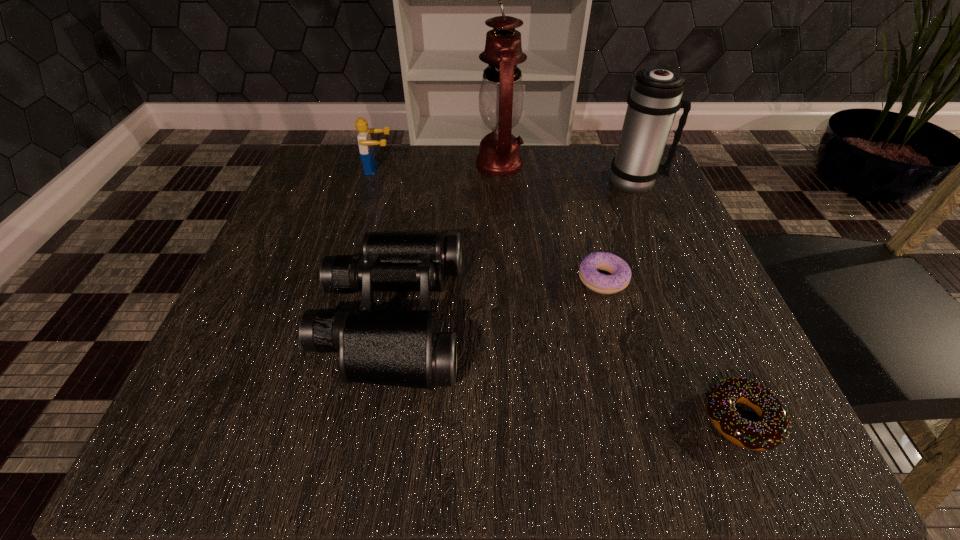
Identify which object is the third nearest to the Lego. Please provide its 2D coordinates. Your answer should be formatted as a tuple, i.e. [(x, y)], where the tuple contains the x and y coordinates of a point satisfying the conditions above.

[(619, 279)]

Identify which object is the second closest to the third object from left to right. Please provide its 2D coordinates. Your answer should be formatted as a tuple, i.e. [(x, y)], where the tuple contains the x and y coordinates of a point satisfying the conditions above.

[(366, 149)]

I want to click on vacant region that satisfies the following two spatial constraints: 1. on the face of the nearer doughnut; 2. on the left side of the Lego, so click(x=306, y=418).

You are a GUI agent. You are given a task and a screenshot of the screen. Output one action in this format:
    pyautogui.click(x=<x>, y=<y>)
    Task: Click on the free region that satisfies the following two spatial constraints: 1. on the side with the handle of the thermos bottle; 2. on the right side of the right doughnut
    
    Given the screenshot: What is the action you would take?
    738,418

This screenshot has width=960, height=540. I want to click on vacant space that satisfies the following two spatial constraints: 1. on the front-facing side of the binoculars; 2. on the right side of the nearer doughnut, so click(372, 418).